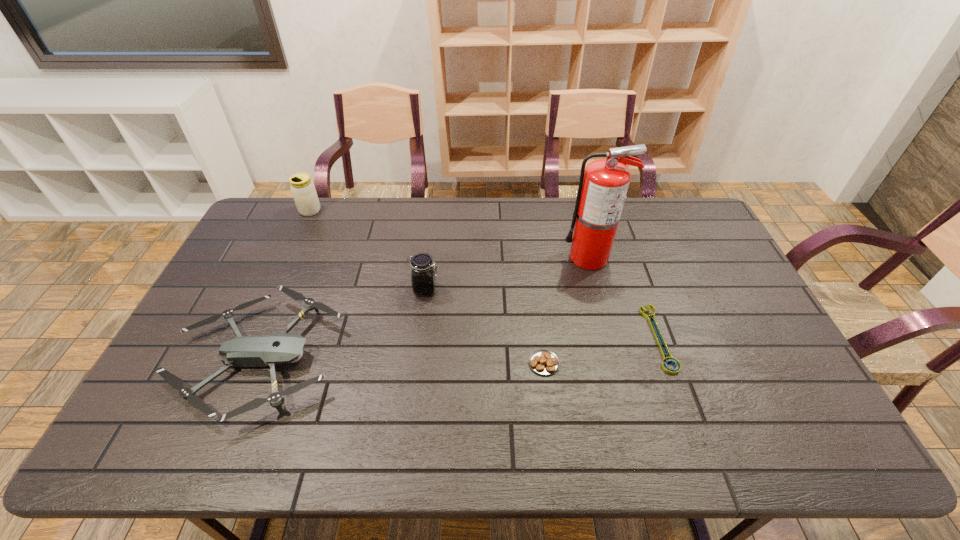
Identify the location of object at the near edge. (268, 350).

Locate an element on the screen. jar that is at the left edge is located at coordinates (303, 190).

You are a GUI agent. You are given a task and a screenshot of the screen. Output one action in this format:
    pyautogui.click(x=<x>, y=<y>)
    Task: Click on the drone that is at the left edge
    This screenshot has width=960, height=540.
    Given the screenshot: What is the action you would take?
    pyautogui.click(x=268, y=350)

Locate an element on the screen. This screenshot has height=540, width=960. object present at the far left corner is located at coordinates (303, 190).

You are a GUI agent. You are given a task and a screenshot of the screen. Output one action in this format:
    pyautogui.click(x=<x>, y=<y>)
    Task: Click on the object that is positioned at the near left corner
    
    Given the screenshot: What is the action you would take?
    pyautogui.click(x=268, y=350)

The image size is (960, 540). I want to click on vacant space at the far edge of the desktop, so click(x=626, y=224).

This screenshot has width=960, height=540. I want to click on free point at the near edge, so click(291, 457).

Where is `vacant space at the left edge of the desktop`? This screenshot has height=540, width=960. vacant space at the left edge of the desktop is located at coordinates (199, 375).

In the image, there is a desktop. Identify the location of free space at the far left corner. This screenshot has width=960, height=540. (276, 204).

Image resolution: width=960 pixels, height=540 pixels. I want to click on empty location between the fourth tallest object and the wrench, so click(x=458, y=348).